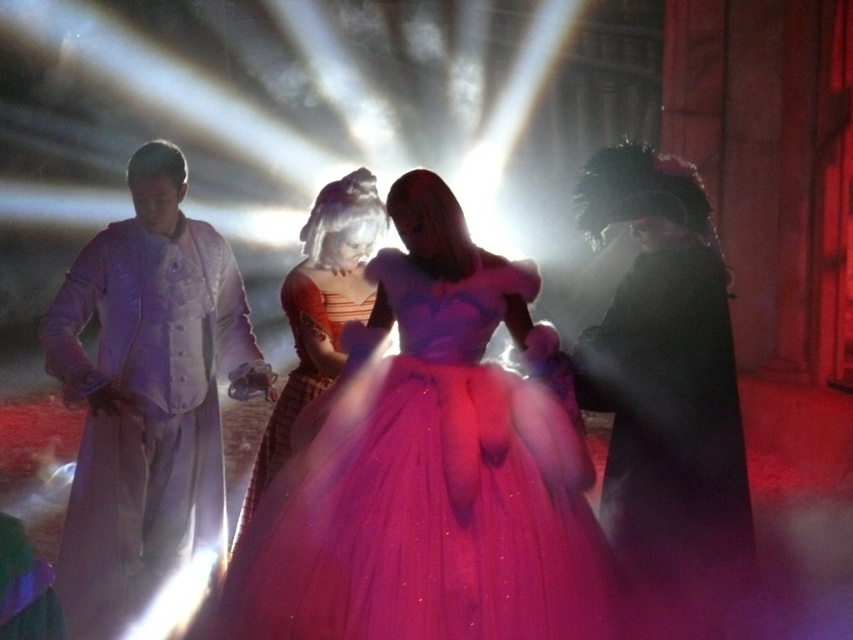
Which is more to the left, sparkly tulle dress at center or matte white coat at left?

matte white coat at left

Is sparkly tulle dress at center behind matte white coat at left?

No.

Is point (486, 520) behind point (167, 141)?

No, it is in front of (167, 141).

Identify the location of sparkly tulle dress at center. (428, 490).

Between matte white coat at left and shiny purple gown at center, which one has less height?

With less height is shiny purple gown at center.

Is matte white coat at left positioned before shiny purple gown at center?

That is False.

Image resolution: width=853 pixels, height=640 pixels. I want to click on matte white coat at left, so click(146, 394).

Is point (405, 392) positioned after point (323, 202)?

No, (405, 392) is closer to viewer.

Between sparkly tulle dress at center and matte orange dress at center, which one is positioned higher?

matte orange dress at center is higher up.

Where is `sparkly tulle dress at center`? The height and width of the screenshot is (640, 853). sparkly tulle dress at center is located at coordinates (428, 490).

Locate an element on the screen. sparkly tulle dress at center is located at coordinates (428, 490).